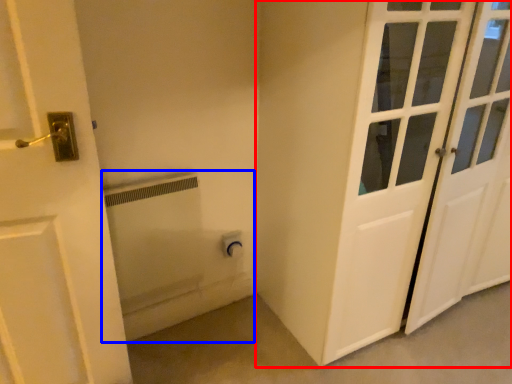
Question: Which object appears farthest to the camera in this image, door (highlighted by a red box) or bath (highlighted by a blue box)?

Choices:
 (A) door
 (B) bath

Answer: (B)